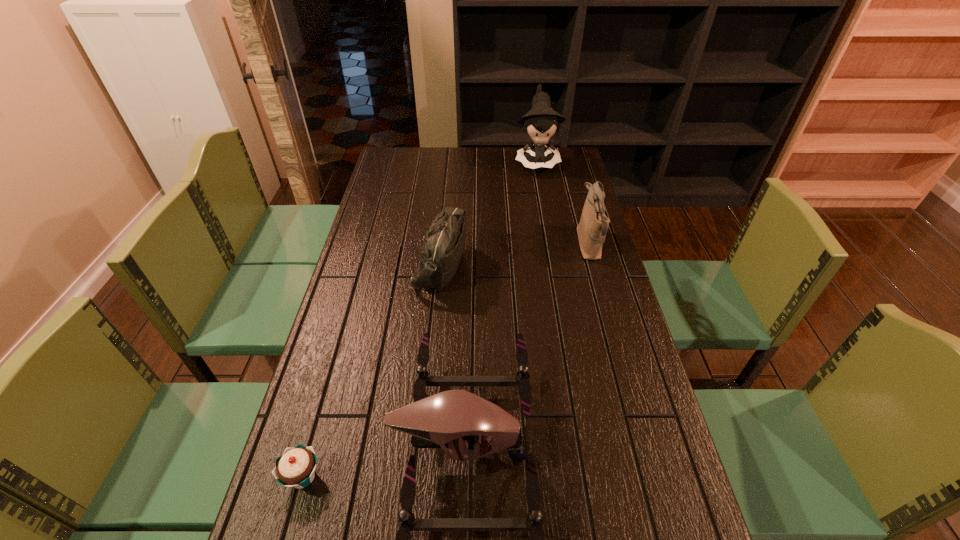
This screenshot has width=960, height=540. Find the location of `blank space at the far right corner of the desktop`. blank space at the far right corner of the desktop is located at coordinates (563, 161).

What are the coordinates of `vacant space that is in between the tallest object and the right shoulder bag` in the screenshot? It's located at (563, 204).

Find the location of `empty location between the tallest object and the left shoulder bag`. empty location between the tallest object and the left shoulder bag is located at coordinates (489, 214).

This screenshot has height=540, width=960. I want to click on free space between the right shoulder bag and the left shoulder bag, so click(515, 255).

This screenshot has width=960, height=540. I want to click on free space between the farthest object and the left shoulder bag, so click(489, 214).

Find the location of a particular element. free space between the left shoulder bag and the cupcake is located at coordinates (372, 372).

The height and width of the screenshot is (540, 960). What are the coordinates of `object that can be found as the closest to the left shoulder bag` in the screenshot? It's located at (471, 427).

Locate an element on the screen. The image size is (960, 540). object that is the fourth closest to the left shoulder bag is located at coordinates (295, 468).

I want to click on vacant point that satisfies the following two spatial constraints: 1. at the face of the tallest object; 2. at the front padded panel of the left shoulder bag, so click(556, 266).

The width and height of the screenshot is (960, 540). What are the coordinates of `vacant space that satisfies the following two spatial constraints: 1. at the face of the doll; 2. at the front padded panel of the left shoulder bag` in the screenshot? It's located at (556, 266).